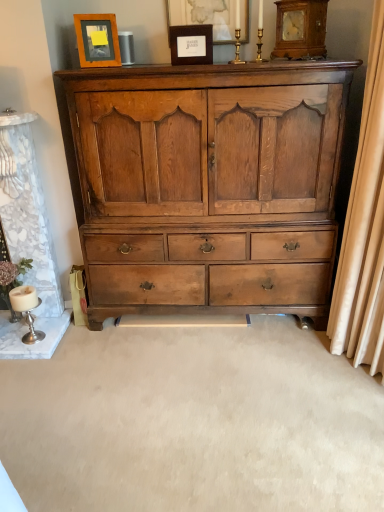
Question: Considering the positions of wooden clock at upper right and matte brown wooden chest of drawers at center in the image, is wooden clock at upper right wider or thinner than matte brown wooden chest of drawers at center?

Choices:
 (A) thin
 (B) wide

Answer: (A)

Question: Is point (292, 5) closer or farther from the camera than point (314, 238)?

Choices:
 (A) farther
 (B) closer

Answer: (B)

Question: Considering the real-world distances, which object is farthest from the matte black picture frame at upper center, placed as the 2th picture frame when sorted from left to right?

Choices:
 (A) beige fabric curtain at right
 (B) wooden frame at upper left, which is the 3th picture frame from right to left
 (C) matte brown wooden chest of drawers at center
 (D) wooden picture frame at upper center, which is counted as the 1th picture frame, starting from the right
 (E) wooden clock at upper right

Answer: (A)

Question: Estimate the real-world distances between objects in this image. Which object is closer to the wooden frame at upper left, which is the 3th picture frame from right to left?

Choices:
 (A) wooden clock at upper right
 (B) matte black picture frame at upper center, placed as the 2th picture frame when sorted from left to right
 (C) matte brown wooden chest of drawers at center
 (D) silver metallic candlestick at lower left
 (E) beige fabric curtain at right

Answer: (B)